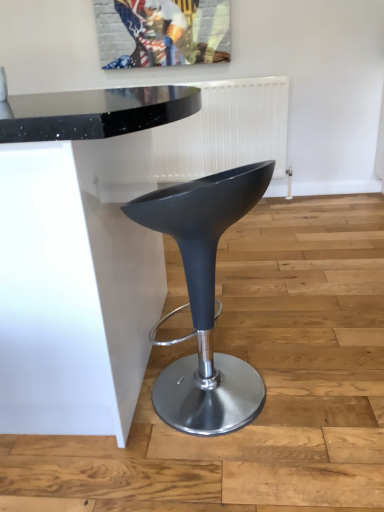
Where is `matte black stool at center`? matte black stool at center is located at coordinates (204, 300).

Describe the element at coordinates (204, 300) in the screenshot. I see `matte black stool at center` at that location.

At what (x,y) coordinates should I click in order to perform the action: click on matte black stool at center. Please return your answer as a coordinate pair (x, y). This screenshot has height=512, width=384. Looking at the image, I should click on (204, 300).